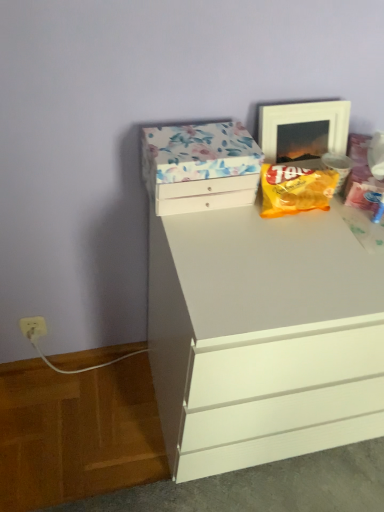
Question: From a real-world perspective, is floral paper-covered box at upper center over yellow matte snack packet at upper right?

Choices:
 (A) yes
 (B) no

Answer: (A)

Question: From a real-world perspective, is floral paper-covered box at upper center positioned under yellow matte snack packet at upper right based on gravity?

Choices:
 (A) yes
 (B) no

Answer: (B)

Question: Can we say floral paper-covered box at upper center lies outside yellow matte snack packet at upper right?

Choices:
 (A) no
 (B) yes

Answer: (B)

Question: Is floral paper-covered box at upper center far from yellow matte snack packet at upper right?

Choices:
 (A) yes
 (B) no

Answer: (B)

Question: Is floral paper-covered box at upper center facing away from yellow matte snack packet at upper right?

Choices:
 (A) yes
 (B) no

Answer: (B)

Question: Is yellow matte snack packet at upper right in front of or behind white matte chest of drawers at center in the image?

Choices:
 (A) front
 (B) behind

Answer: (B)

Question: Does point (276, 169) appear closer or farther from the camera than point (193, 395)?

Choices:
 (A) closer
 (B) farther

Answer: (B)

Question: From the image's perspective, relative to white matte chest of drawers at center, is yellow matte snack packet at upper right above or below?

Choices:
 (A) above
 (B) below

Answer: (A)

Question: Based on their positions, is yellow matte snack packet at upper right located to the left or right of white matte chest of drawers at center?

Choices:
 (A) right
 (B) left

Answer: (B)

Question: Is yellow matte snack packet at upper right inside the boundaries of white glossy picture frame at upper right, or outside?

Choices:
 (A) inside
 (B) outside

Answer: (B)

Question: In terms of size, does yellow matte snack packet at upper right appear bigger or smaller than white glossy picture frame at upper right?

Choices:
 (A) small
 (B) big

Answer: (A)

Question: In the image, is yellow matte snack packet at upper right positioned in front of or behind white glossy picture frame at upper right?

Choices:
 (A) behind
 (B) front

Answer: (B)

Question: Is yellow matte snack packet at upper right to the left or to the right of white glossy picture frame at upper right in the image?

Choices:
 (A) right
 (B) left

Answer: (B)

Question: Looking at the image, does white plastic electric outlet at lower left seem bigger or smaller compared to floral paper-covered box at upper center?

Choices:
 (A) small
 (B) big

Answer: (A)

Question: Is point (36, 335) closer or farther from the camera than point (188, 197)?

Choices:
 (A) closer
 (B) farther

Answer: (B)